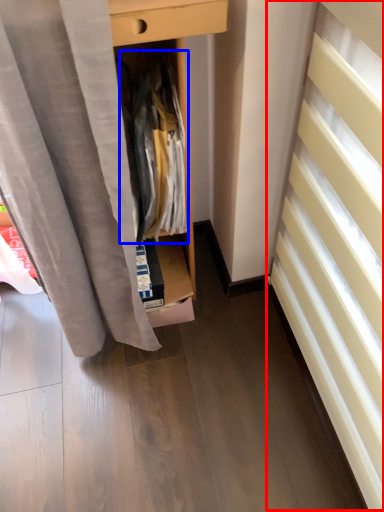
Question: Which of the following is the closest to the observer, stairwell (highlighted by a red box) or clothing (highlighted by a blue box)?

Choices:
 (A) stairwell
 (B) clothing

Answer: (A)